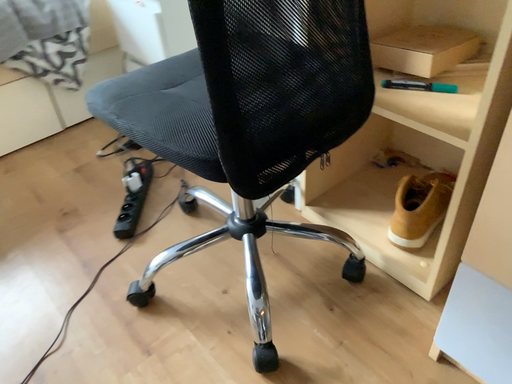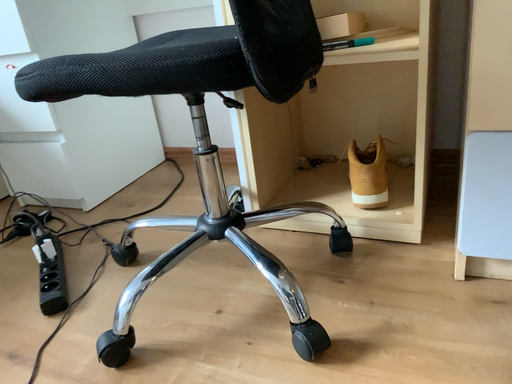
Question: Which way did the camera rotate in the video?

Choices:
 (A) rotated left
 (B) rotated right

Answer: (B)